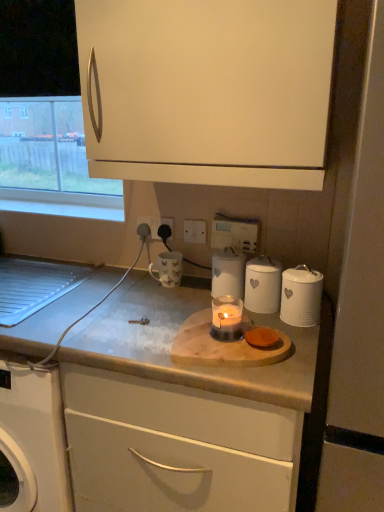
Identify the location of vacant region below white matte cabinet at upper center, which is the second cabinetry from bottom to top (from a real-world perspective). The width and height of the screenshot is (384, 512). pyautogui.click(x=171, y=302).